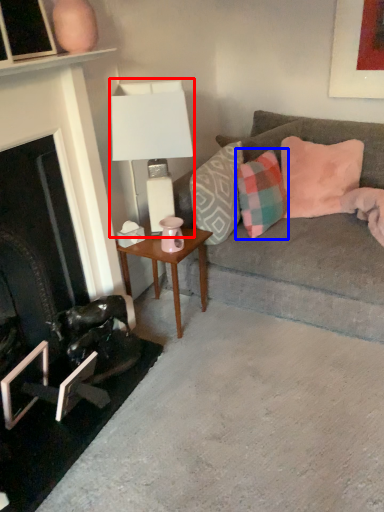
Question: Which of the following is the farthest to the observer, table lamp (highlighted by a red box) or pillow (highlighted by a blue box)?

Choices:
 (A) table lamp
 (B) pillow

Answer: (B)